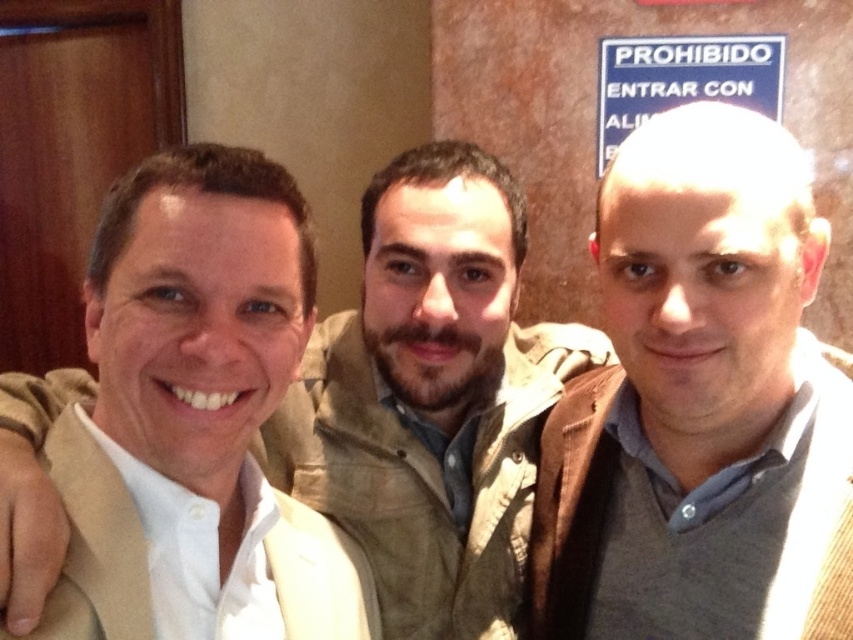
Question: Can you confirm if gray wool sweater at center is positioned below white shirt at center?

Choices:
 (A) no
 (B) yes

Answer: (B)

Question: Does gray wool sweater at center appear on the right side of white shirt at center?

Choices:
 (A) no
 (B) yes

Answer: (B)

Question: Can you confirm if gray wool sweater at center is smaller than white shirt at center?

Choices:
 (A) yes
 (B) no

Answer: (A)

Question: Which point is farther to the camera?

Choices:
 (A) (630, 396)
 (B) (467, 488)

Answer: (B)

Question: Which point is closer to the camera?

Choices:
 (A) (460, 509)
 (B) (679, 524)

Answer: (B)